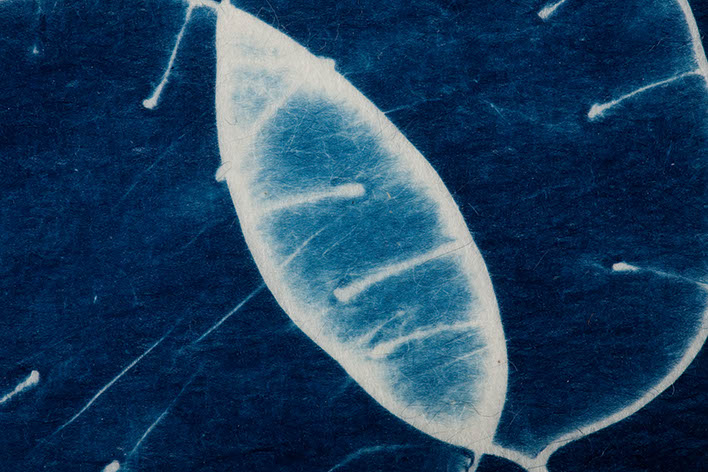
Identify the location of light. (38, 52).